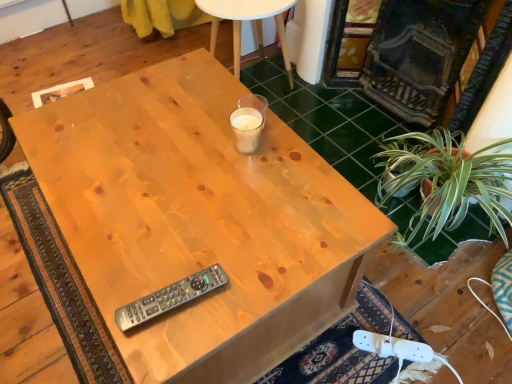
You are a GUI agent. You are given a task and a screenshot of the screen. Output one action in this format:
    pyautogui.click(x=<x>, y=<y>)
    Task: Click on the free space above natural wood desk at center (from a real-world perspective)
    This screenshot has width=512, height=384.
    Given the screenshot: What is the action you would take?
    pyautogui.click(x=189, y=203)